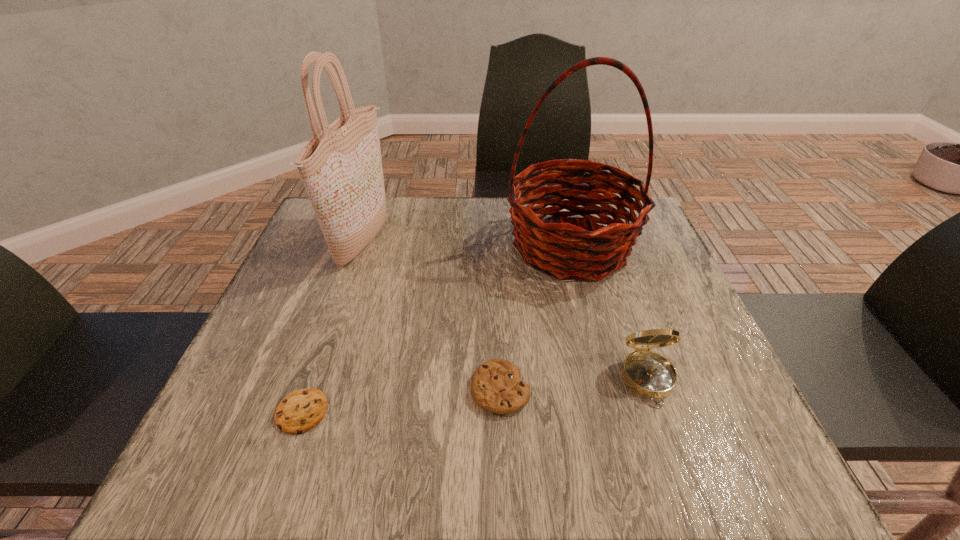
Identify the location of shopping bag. pos(341,167).

This screenshot has height=540, width=960. Identify the location of basket. (565, 250).

The height and width of the screenshot is (540, 960). In order to click on the third shortest object in this screenshot , I will do `click(648, 374)`.

Locate an element on the screen. This screenshot has width=960, height=540. the fourth tallest object is located at coordinates (497, 387).

The height and width of the screenshot is (540, 960). What are the coordinates of `the taller cookie` in the screenshot? It's located at (497, 387).

Where is `the shortest object`? This screenshot has width=960, height=540. the shortest object is located at coordinates (300, 411).

Where is `the left cookie`? The height and width of the screenshot is (540, 960). the left cookie is located at coordinates (300, 411).

Locate an element on the screen. This screenshot has width=960, height=540. vacant space located on the front of the shopping bag is located at coordinates (324, 358).

You are a GUI agent. You are given a task and a screenshot of the screen. Output one action in this format:
    pyautogui.click(x=<x>, y=<y>)
    Task: Click on the vacant region located on the front of the basket
    This screenshot has height=540, width=960.
    Given the screenshot: What is the action you would take?
    pyautogui.click(x=623, y=452)

What are the coordinates of `free spot located 0.060m with the dial facing the third shortest object` in the screenshot? It's located at (669, 442).